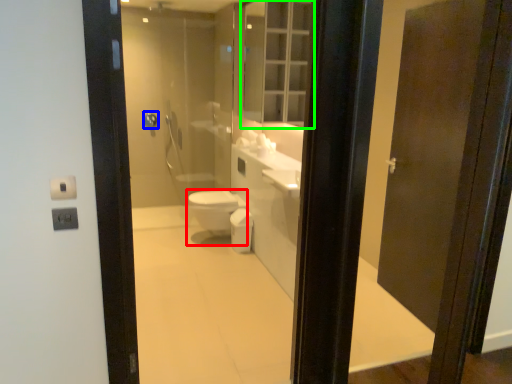
Question: Which object is positioned farthest from bidet (highlighted by a red box)? Select from towel bar (highlighted by a blue box) and medicine cabinet (highlighted by a green box).

Choices:
 (A) towel bar
 (B) medicine cabinet

Answer: (A)